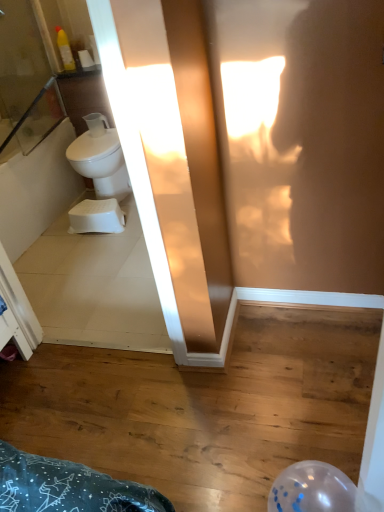
Question: Considering the relative sizes of white matte toilet paper at upper left and white glossy toilet at left in the image provided, is white matte toilet paper at upper left shorter than white glossy toilet at left?

Choices:
 (A) no
 (B) yes

Answer: (B)

Question: Does white matte toilet paper at upper left lie in front of white glossy toilet at left?

Choices:
 (A) yes
 (B) no

Answer: (B)

Question: From a real-world perspective, is white matte toilet paper at upper left positioned under white glossy toilet at left based on gravity?

Choices:
 (A) no
 (B) yes

Answer: (A)

Question: Does white matte toilet paper at upper left have a greater width compared to white glossy toilet at left?

Choices:
 (A) no
 (B) yes

Answer: (A)

Question: Does white matte toilet paper at upper left have a lesser width compared to white glossy toilet at left?

Choices:
 (A) no
 (B) yes

Answer: (B)

Question: Is white matte toilet paper at upper left at the right side of white glossy toilet at left?

Choices:
 (A) no
 (B) yes

Answer: (A)

Question: Considering the relative sizes of white plastic step stool at lower left and white matte toilet paper at upper left in the image provided, is white plastic step stool at lower left bigger than white matte toilet paper at upper left?

Choices:
 (A) yes
 (B) no

Answer: (A)

Question: Is white plastic step stool at lower left positioned with its back to white matte toilet paper at upper left?

Choices:
 (A) yes
 (B) no

Answer: (B)

Question: Is white plastic step stool at lower left far away from white matte toilet paper at upper left?

Choices:
 (A) yes
 (B) no

Answer: (A)

Question: From the image's perspective, is white plastic step stool at lower left located above white matte toilet paper at upper left?

Choices:
 (A) yes
 (B) no

Answer: (B)

Question: From a real-world perspective, is white plastic step stool at lower left on top of white matte toilet paper at upper left?

Choices:
 (A) yes
 (B) no

Answer: (B)

Question: Is white matte toilet paper at upper left located within white plastic step stool at lower left?

Choices:
 (A) no
 (B) yes

Answer: (A)

Question: Does white glossy toilet at left appear on the right side of white matte toilet paper at upper left?

Choices:
 (A) yes
 (B) no

Answer: (A)